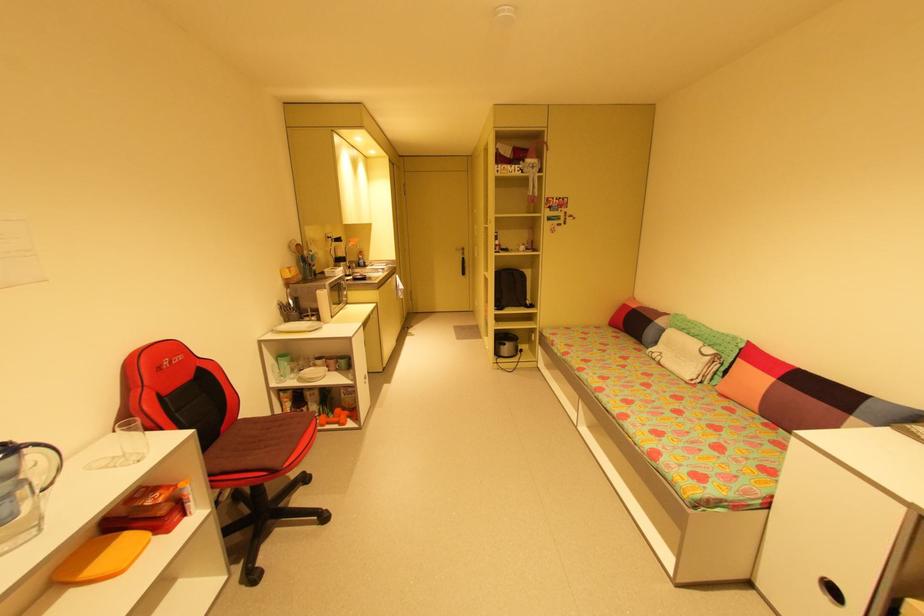
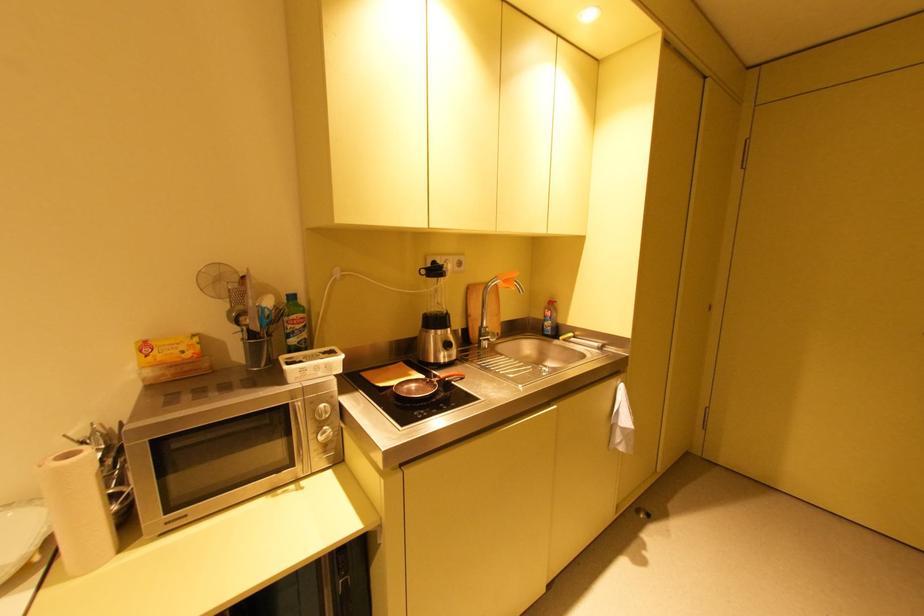
Where in the second image is the point corresponding to [365,262] from the first image?

(551, 323)